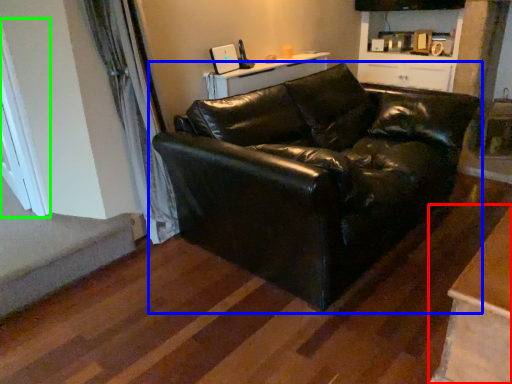
Question: Considering the real-world distances, which object is farthest from table (highlighted by a red box)? studio couch (highlighted by a blue box) or window (highlighted by a green box)?

Choices:
 (A) studio couch
 (B) window

Answer: (B)